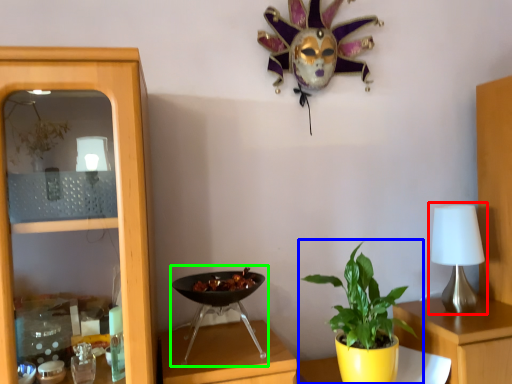
Question: Which is nearer to the table lamp (highlighted by a red box)? houseplant (highlighted by a blue box) or wok (highlighted by a green box).

Choices:
 (A) houseplant
 (B) wok

Answer: (A)